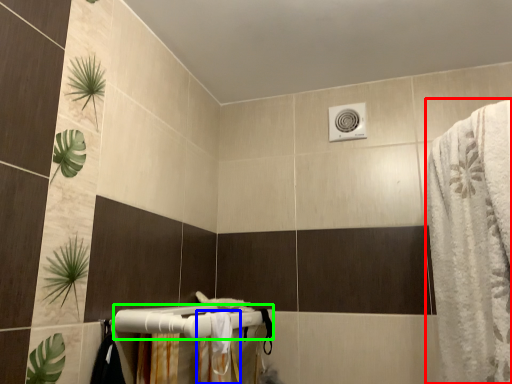
Question: Which object is positioned farthest from bath towel (highlighted by a red box)? Select from shower curtain (highlighted by a blue box) and towel bar (highlighted by a green box).

Choices:
 (A) shower curtain
 (B) towel bar

Answer: (B)